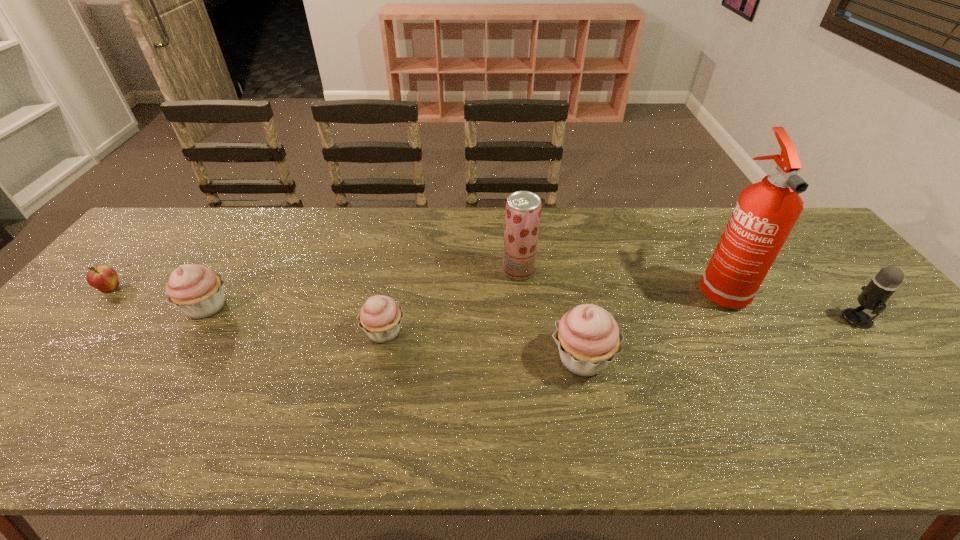
Where is `free space between the leftmost cupcake and the second object from right to left`? free space between the leftmost cupcake and the second object from right to left is located at coordinates (463, 297).

Where is `vacant space that's between the fifth tallest object and the microphone`? The image size is (960, 540). vacant space that's between the fifth tallest object and the microphone is located at coordinates (532, 313).

This screenshot has height=540, width=960. What are the coordinates of `free space that is in between the fire extinguisher and the leftmost cupcake` in the screenshot? It's located at (463, 297).

Locate an element on the screen. Image resolution: width=960 pixels, height=540 pixels. empty space between the rightmost object and the second cupcake from right to left is located at coordinates (621, 325).

Select which object is the fifth closest to the apple. Please provide its 2D coordinates. Your answer should be formatted as a tuple, i.e. [(x, y)], where the tuple contains the x and y coordinates of a point satisfying the conditions above.

[(766, 212)]

Locate which object is the fifth closest to the third object from right to left. Please provide its 2D coordinates. Your answer should be formatted as a tuple, i.e. [(x, y)], where the tuple contains the x and y coordinates of a point satisfying the conditions above.

[(197, 290)]

Select which cupcake is the second closest to the fourth object from right to left. Please provide its 2D coordinates. Your answer should be formatted as a tuple, i.e. [(x, y)], where the tuple contains the x and y coordinates of a point satisfying the conditions above.

[(381, 316)]

Locate an element on the screen. cupcake that is the closest to the second object from right to left is located at coordinates (588, 338).

The image size is (960, 540). Find the location of `free space that satisfies the following two spatial constraints: 1. at the nozzle of the rightmost object; 2. on the left side of the second object from right to left`. free space that satisfies the following two spatial constraints: 1. at the nozzle of the rightmost object; 2. on the left side of the second object from right to left is located at coordinates (737, 319).

You are a GUI agent. You are given a task and a screenshot of the screen. Output one action in this format:
    pyautogui.click(x=<x>, y=<y>)
    Task: Click on the vacant region that satisfies the following two spatial constraints: 1. on the back side of the third object from left to right; 2. on the right side of the rightmost object
    
    Given the screenshot: What is the action you would take?
    pyautogui.click(x=387, y=319)